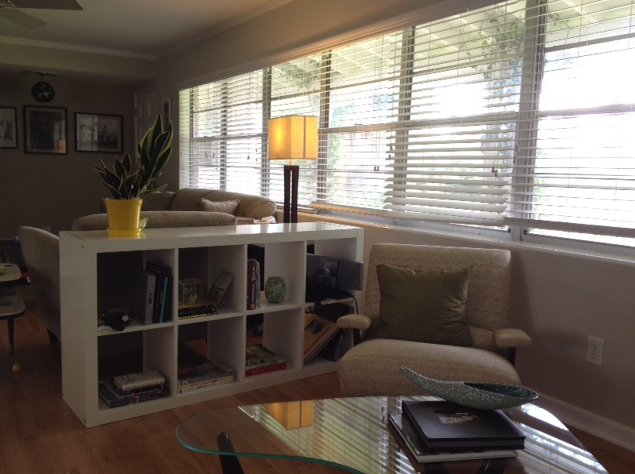
Image resolution: width=635 pixels, height=474 pixels. In order to click on table in this screenshot , I will do `click(333, 433)`.